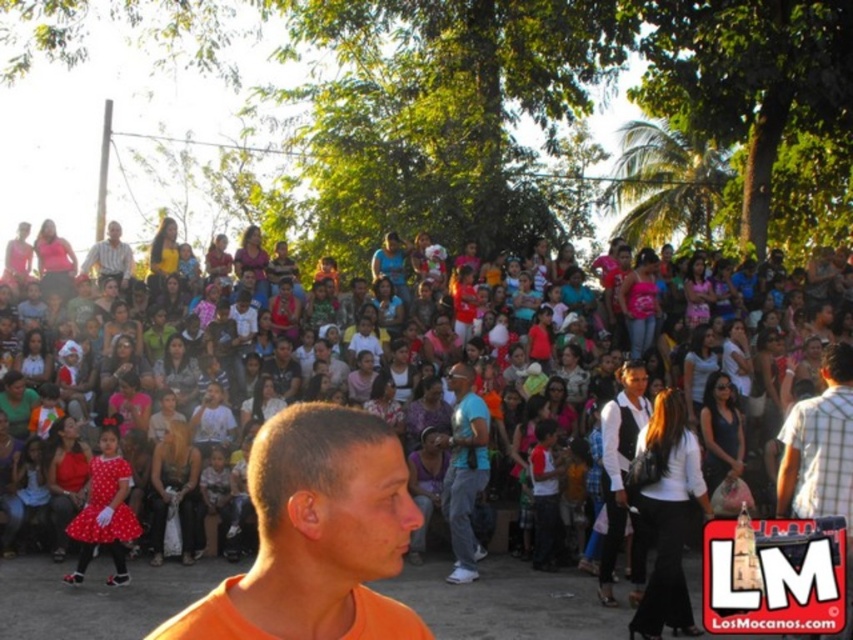
Looking at this image, you are a photographer trying to capture a clear shot of the white matte vest at center and the blue fabric shirt at center in the crowd. Based on their sizes, which one would appear larger in your photo?

The white matte vest at center appears larger in the photo because it is much taller than the blue fabric shirt at center.

You are a photographer trying to capture a closeup of the white matte vest at center and the blue fabric shirt at center. Which one will appear larger in your photo?

The white matte vest at center will appear larger in the photo because it is closer to the viewer than the blue fabric shirt at center.